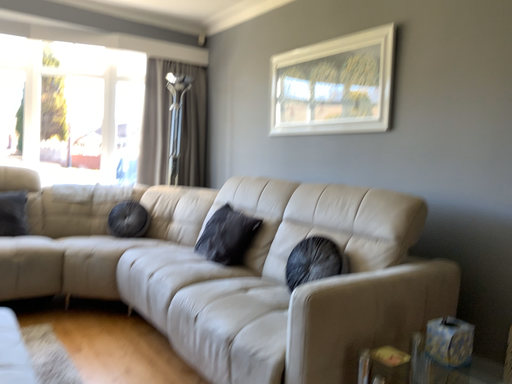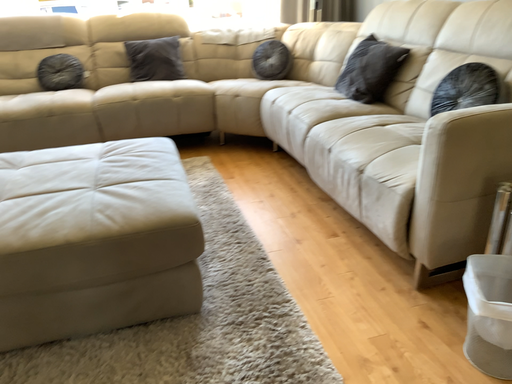
Question: How did the camera likely rotate when shooting the video?

Choices:
 (A) rotated right
 (B) rotated left

Answer: (B)